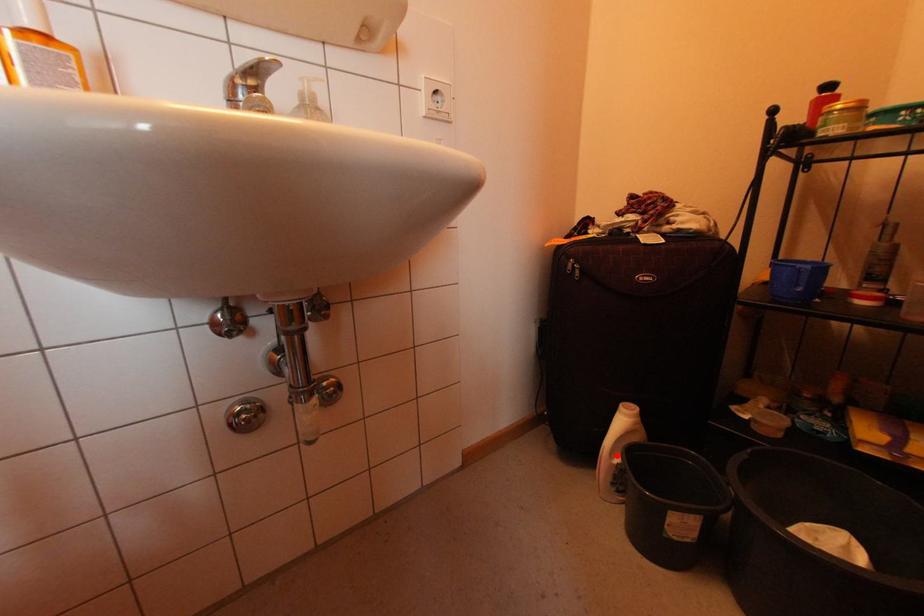
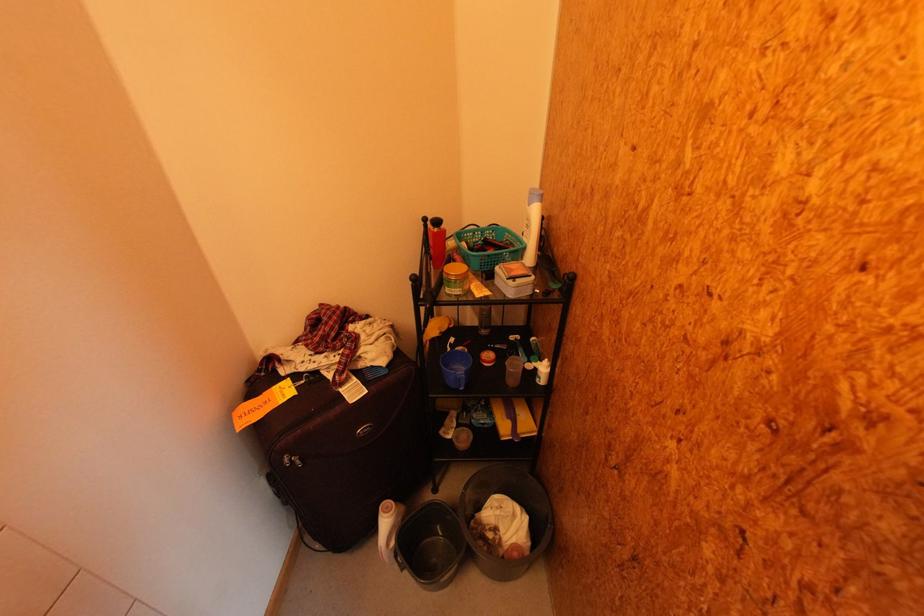
Find the pixel in the second image that matches the highlighted location in the first image.

(393, 546)